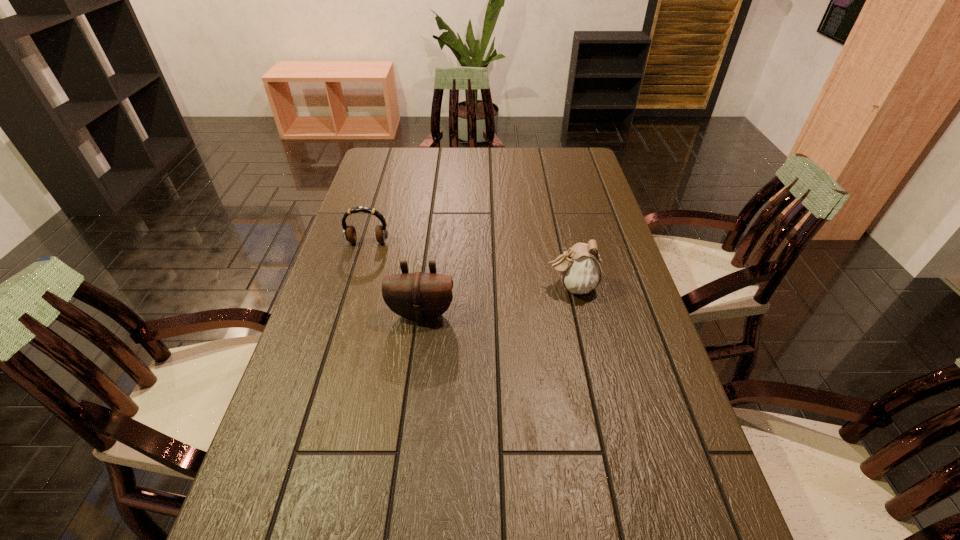
Locate an element on the screen. The width and height of the screenshot is (960, 540). object that is at the right edge is located at coordinates (580, 269).

The width and height of the screenshot is (960, 540). In order to click on blank space at the far edge of the desktop in this screenshot , I will do `click(494, 158)`.

Identify the location of vacant space at the left edge. (319, 363).

You are a GUI agent. You are given a task and a screenshot of the screen. Output one action in this format:
    pyautogui.click(x=<x>, y=<y>)
    Task: Click on the vacant position at the right edge of the desktop
    
    Given the screenshot: What is the action you would take?
    pyautogui.click(x=597, y=345)

Image resolution: width=960 pixels, height=540 pixels. Identify the location of vacant space at the far right corner of the desktop. (572, 176).

Locate an element on the screen. The image size is (960, 540). vacant area that lies between the rightmost object and the farthest object is located at coordinates (469, 265).

Image resolution: width=960 pixels, height=540 pixels. I want to click on vacant region between the rightmost object and the farthest object, so click(469, 265).

Where is `empty space between the right pouch and the farthest object`? The image size is (960, 540). empty space between the right pouch and the farthest object is located at coordinates coord(469,265).

This screenshot has width=960, height=540. I want to click on free spot between the rightmost object and the farthest object, so click(x=469, y=265).

Where is `free space between the second object from right to left and the rightmost object`? free space between the second object from right to left and the rightmost object is located at coordinates (496, 300).